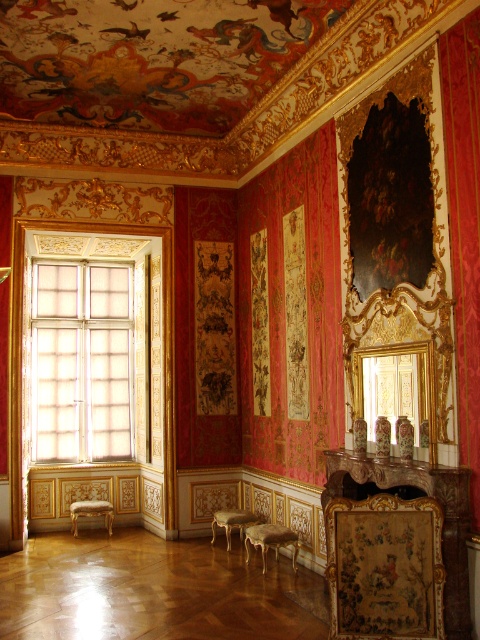
You are a guest entering this grand room and want to sit on one of the gold upholstered stools. If you first see the gold upholstered stool at lower left, which direction should you move to reach the gold upholstered stool at lower center?

The gold upholstered stool at lower center is to the right of the gold upholstered stool at lower left. Therefore, you should move to your right to reach the gold upholstered stool at lower center.

You are an interior designer planning to place a new piece of furniture in this room. You have a large rectangular table that is 2 meters wide. You want to position it near the translucent glass window at left and the gold upholstered stool at lower left. Based on the sizes of these objects, can you determine if the table will fit between them horizontally?

The translucent glass window at left is wider than the gold upholstered stool at lower left. Since the table is 2 meters wide, you need to ensure there is enough space between them. However, without knowing the exact distance between the window and the stool, it is impossible to confirm if the table will fit. Please measure the available space before placing the table.

You are standing in this grand room and notice two points marked in the scene. The first point is at coordinates point (266, 531) and the second is at point (106, 513). Which of these two points is closer to your current position as you look at the scene?

Point (266, 531) is closer to the camera than point (106, 513), so the first point is closer to your current position.